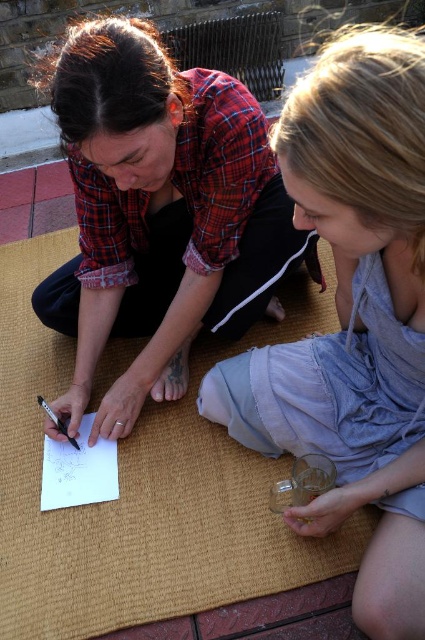
Question: Estimate the real-world distances between objects in this image. Which object is farther from the gray cotton dress at lower right?

Choices:
 (A) black plastic pen at lower left
 (B) white paper at center

Answer: (A)

Question: Which object is farther from the camera taking this photo?

Choices:
 (A) brown woven mat at center
 (B) matte plaid shirt at center

Answer: (A)

Question: Can you confirm if brown woven mat at center is positioned below white paper at center?

Choices:
 (A) yes
 (B) no

Answer: (B)

Question: Considering the real-world distances, which object is closest to the black plastic pen at lower left?

Choices:
 (A) gray cotton dress at lower right
 (B) matte plaid shirt at center

Answer: (B)

Question: Can you confirm if matte plaid shirt at center is positioned to the left of black plastic pen at lower left?

Choices:
 (A) no
 (B) yes

Answer: (A)

Question: Can you confirm if matte plaid shirt at center is wider than white paper at center?

Choices:
 (A) no
 (B) yes

Answer: (B)